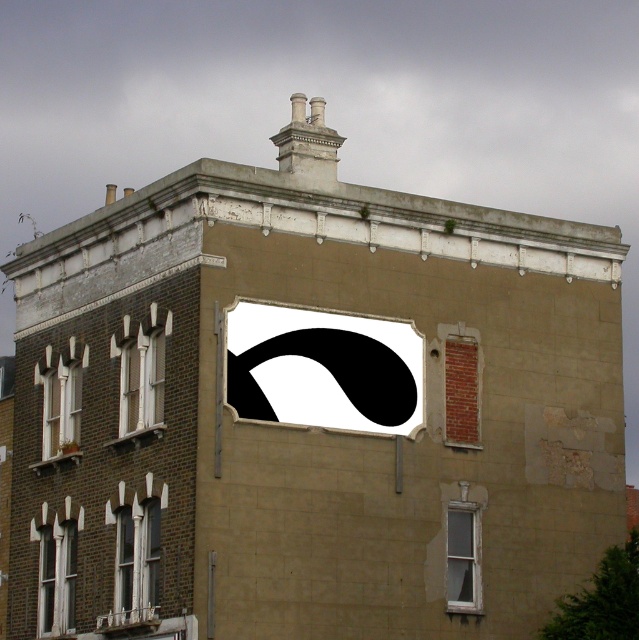
You are standing in front of the residential building and notice the matte white window at lower left. Can you determine its exact coordinates on the facade?

The matte white window at lower left is located at point coordinates of (x=56, y=577).

You are a window installer assessing the building facade. You need to replace the smaller window. Which window should you choose between the matte white window at lower left and the clear glass window at lower right?

The clear glass window at lower right is smaller in size than the matte white window at lower left, so you should choose the clear glass window at lower right for replacement.